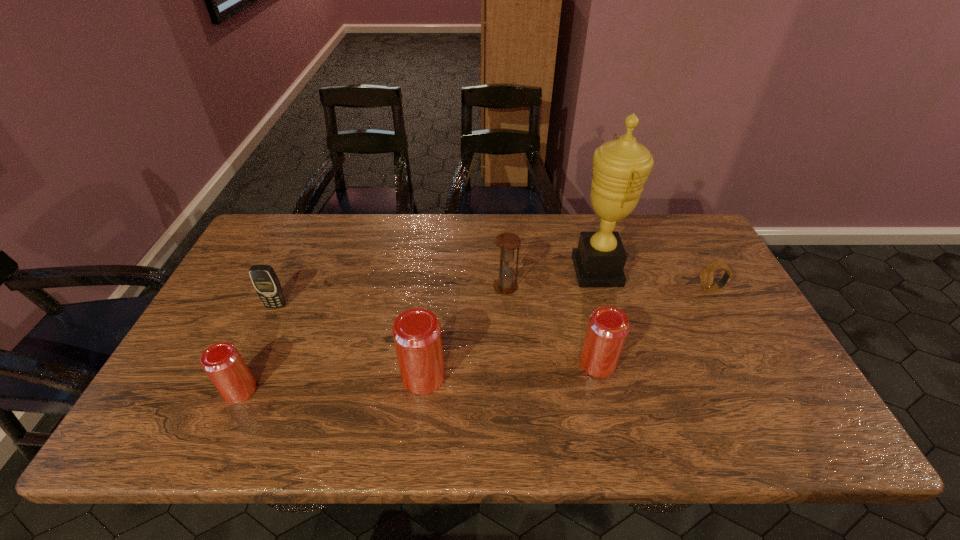
Locate an element on the screen. The width and height of the screenshot is (960, 540). vacant place for an extra beer can on the right is located at coordinates (762, 352).